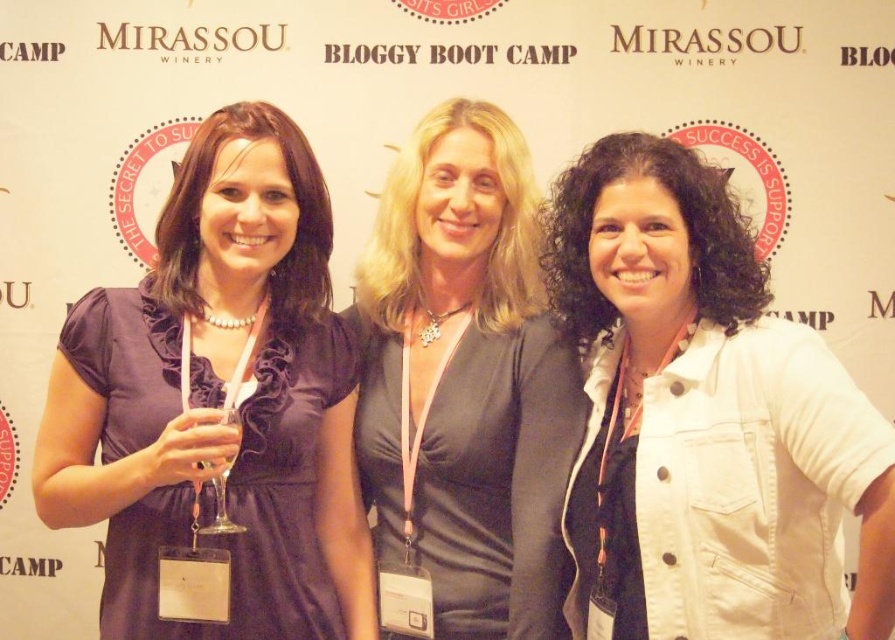
Is matte purple dress at left smaller than black satin dress at center?

No.

Identify the location of matte purple dress at left. (219, 397).

Does clear glass wine at center have a greater height compared to clear glass wine glass at center?

No, clear glass wine at center is not taller than clear glass wine glass at center.

Which is behind, point (211, 464) or point (205, 528)?

Positioned behind is point (205, 528).

Locate an element on the screen. clear glass wine at center is located at coordinates (218, 445).

Is matte purple dress at left to the left of clear glass wine at center from the viewer's perspective?

Yes, matte purple dress at left is to the left of clear glass wine at center.

Who is more forward, (180, 467) or (201, 433)?

Point (201, 433)

Does point (337, 371) come closer to viewer compared to point (205, 442)?

That is False.

I want to click on matte purple dress at left, so click(219, 397).